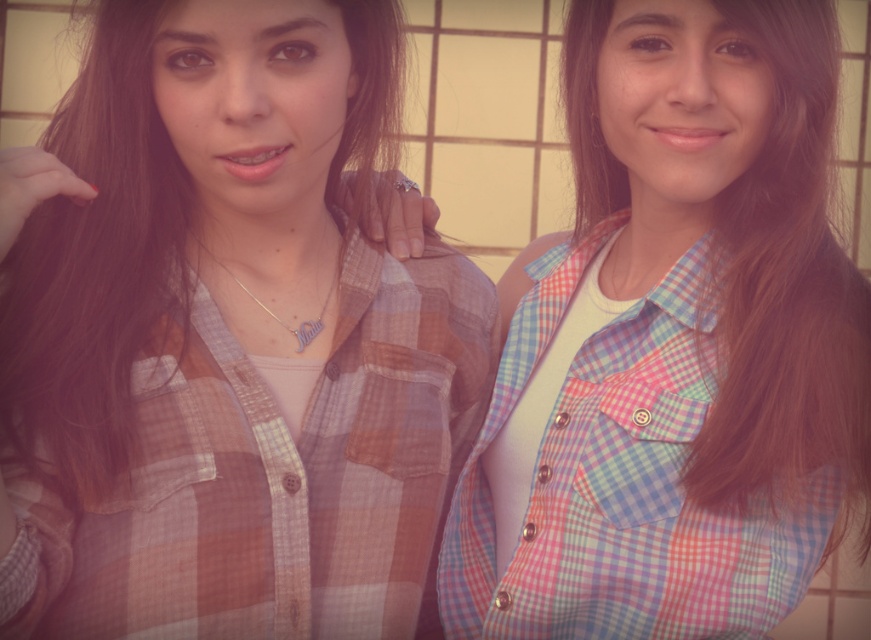
Question: Which object is farther from the camera taking this photo?

Choices:
 (A) brownsmoothhair at left
 (B) brown silky hair at center

Answer: (B)

Question: Does brown silky hair at center have a smaller size compared to brownsmoothhair at left?

Choices:
 (A) no
 (B) yes

Answer: (A)

Question: Can you confirm if brown silky hair at center is positioned to the left of brownsmoothhair at left?

Choices:
 (A) no
 (B) yes

Answer: (A)

Question: Is brown silky hair at center below brownsmoothhair at left?

Choices:
 (A) yes
 (B) no

Answer: (B)